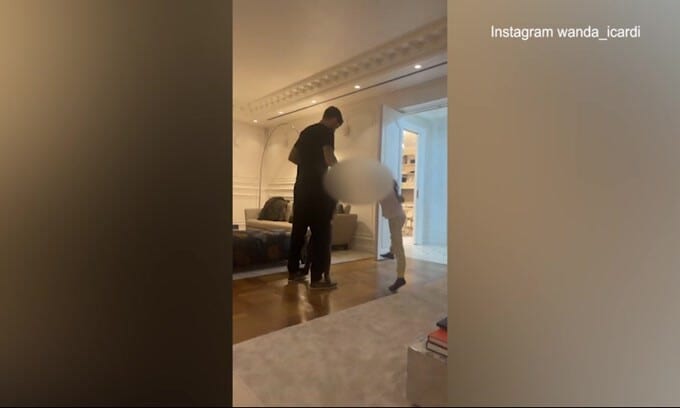
Find the location of a particular element. door is located at coordinates (419, 192).